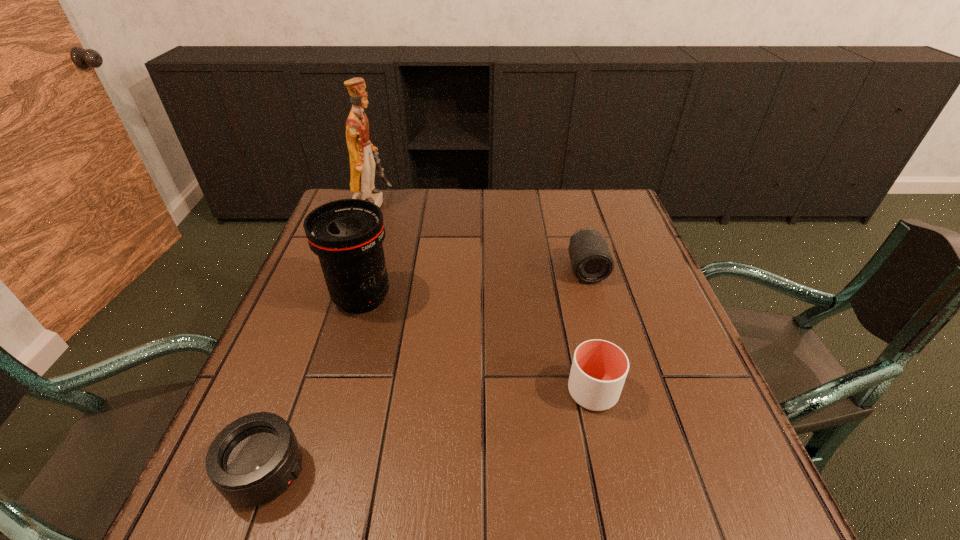
Find the location of a particular element. This screenshot has width=960, height=540. vacant position in the image that satisfies the following two spatial constraints: 1. on the front-facing side of the farthest object; 2. on the right side of the cup is located at coordinates (306, 392).